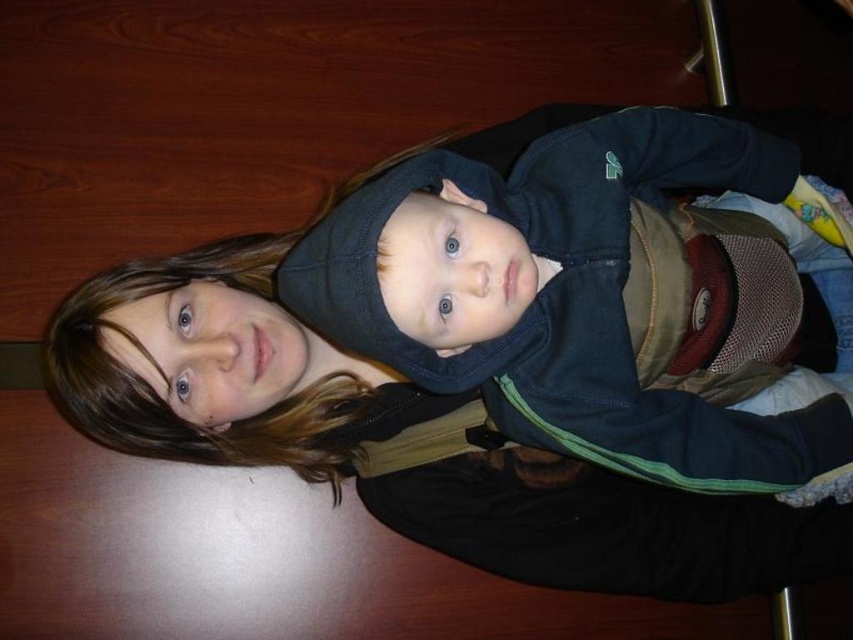
Question: Does matte black jacket at center appear on the right side of dark blue fleece at center?

Choices:
 (A) yes
 (B) no

Answer: (B)

Question: Which object is closer to the camera taking this photo?

Choices:
 (A) dark blue fleece at center
 (B) matte black jacket at center

Answer: (A)

Question: Is matte black jacket at center smaller than dark blue fleece at center?

Choices:
 (A) yes
 (B) no

Answer: (B)

Question: Which point is closer to the camera?

Choices:
 (A) matte black jacket at center
 (B) dark blue fleece at center

Answer: (B)

Question: Is matte black jacket at center to the right of dark blue fleece at center from the viewer's perspective?

Choices:
 (A) yes
 (B) no

Answer: (B)